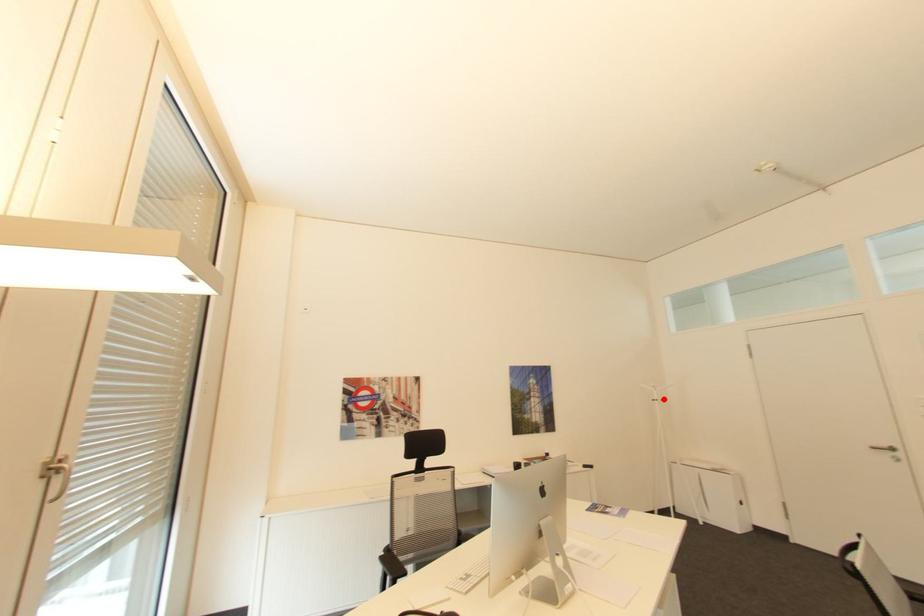
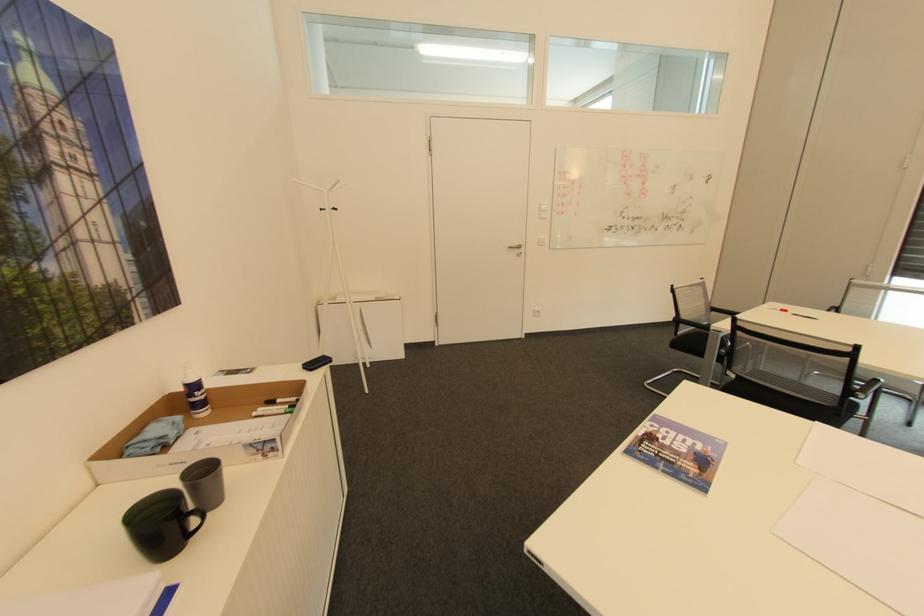
Question: I am providing you with two images of the same scene from different viewpoints. A red point is marked on the first image. Can you still see the location of the red point in image 2?

Choices:
 (A) Yes
 (B) No

Answer: (A)